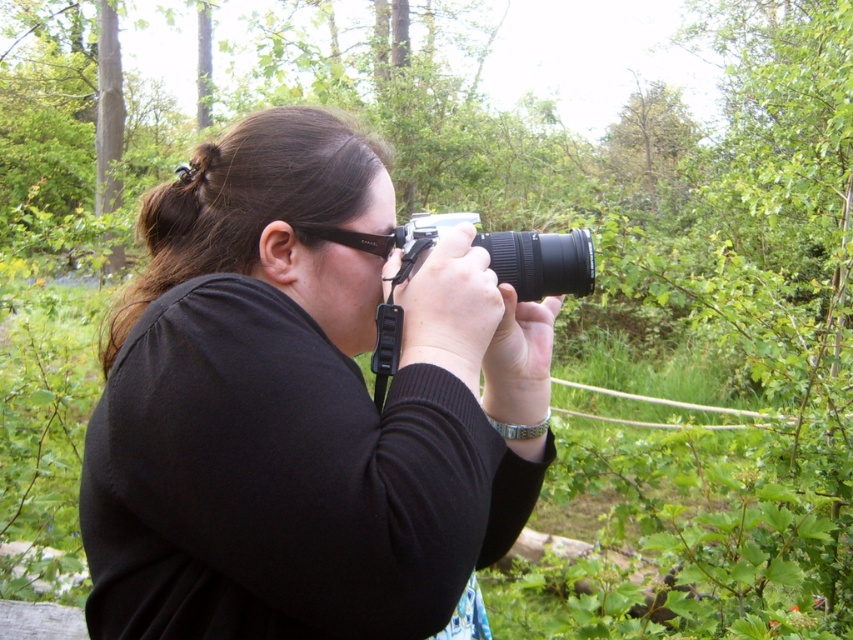
Question: Can you confirm if black matte camera at center is positioned to the right of black rubber glasses at center?

Choices:
 (A) yes
 (B) no

Answer: (B)

Question: From the image, what is the correct spatial relationship of black matte camera at center in relation to black rubber glasses at center?

Choices:
 (A) right
 (B) left

Answer: (B)

Question: Which point is closer to the camera taking this photo?

Choices:
 (A) (312, 225)
 (B) (535, 300)

Answer: (A)

Question: Which of the following is the farthest from the observer?

Choices:
 (A) (368, 241)
 (B) (576, 264)

Answer: (A)

Question: Can you confirm if black matte camera at center is smaller than black plastic camera at center?

Choices:
 (A) no
 (B) yes

Answer: (A)

Question: Which object appears farthest from the camera in this image?

Choices:
 (A) black rubber glasses at center
 (B) black plastic camera at center
 (C) black matte camera at center

Answer: (A)